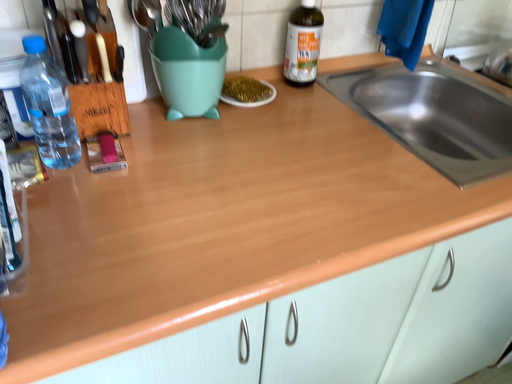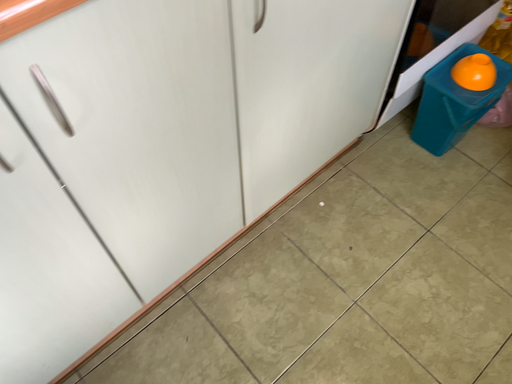
Question: How did the camera likely rotate when shooting the video?

Choices:
 (A) rotated right
 (B) rotated left

Answer: (A)